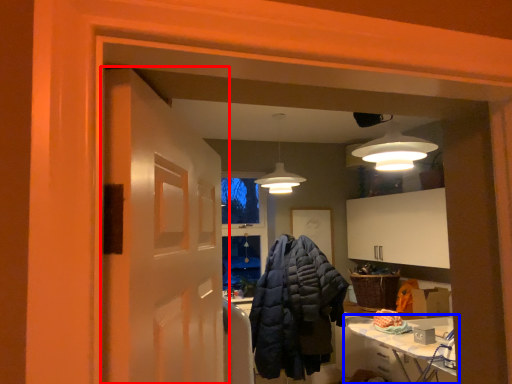
Question: Among these objects, which one is nearest to the camera, door (highlighted by a red box) or table (highlighted by a blue box)?

Choices:
 (A) door
 (B) table

Answer: (A)